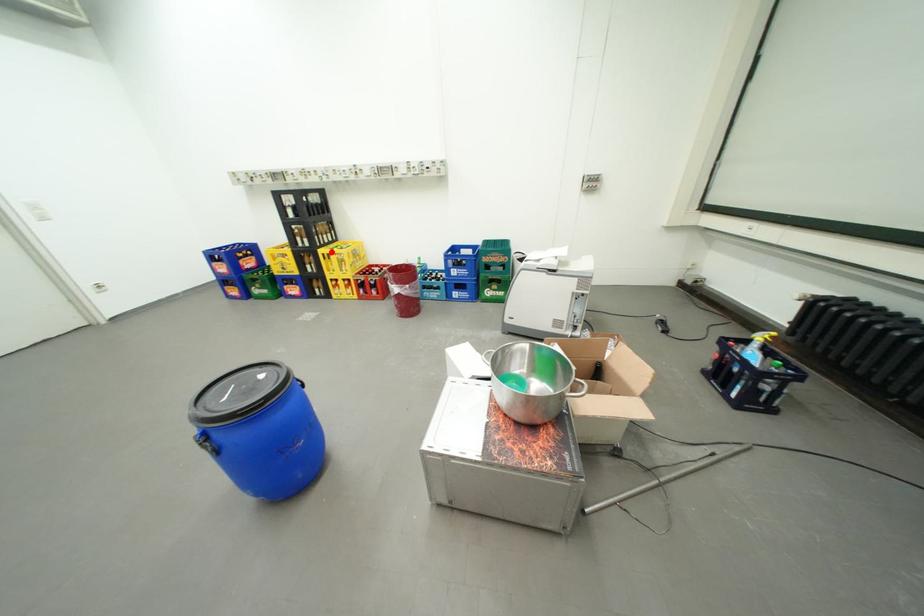
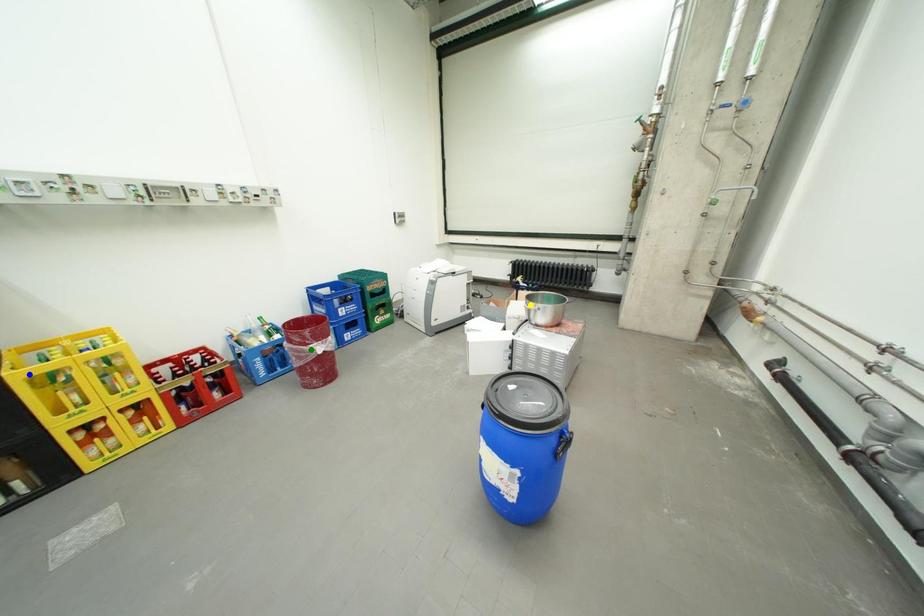
Question: I am providing you with two images of the same scene from different viewpoints. A red point is marked on the first image. You are given multiple points on the second image. Can you choose the point in image 2 that corresponds to the point in image 1?

Choices:
 (A) yellow point
 (B) blue point
 (C) green point

Answer: (B)